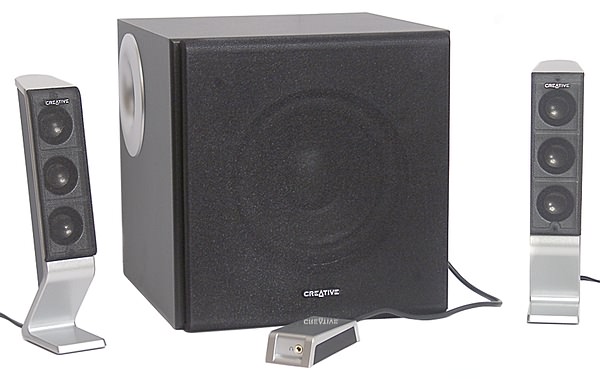
Where is `1 right speaker`? 1 right speaker is located at coordinates (555, 184).